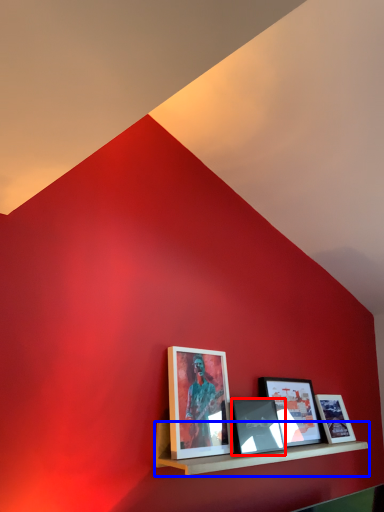
Question: Which object is further to the camera taking this photo, picture frame (highlighted by a red box) or shelf (highlighted by a blue box)?

Choices:
 (A) picture frame
 (B) shelf

Answer: (A)